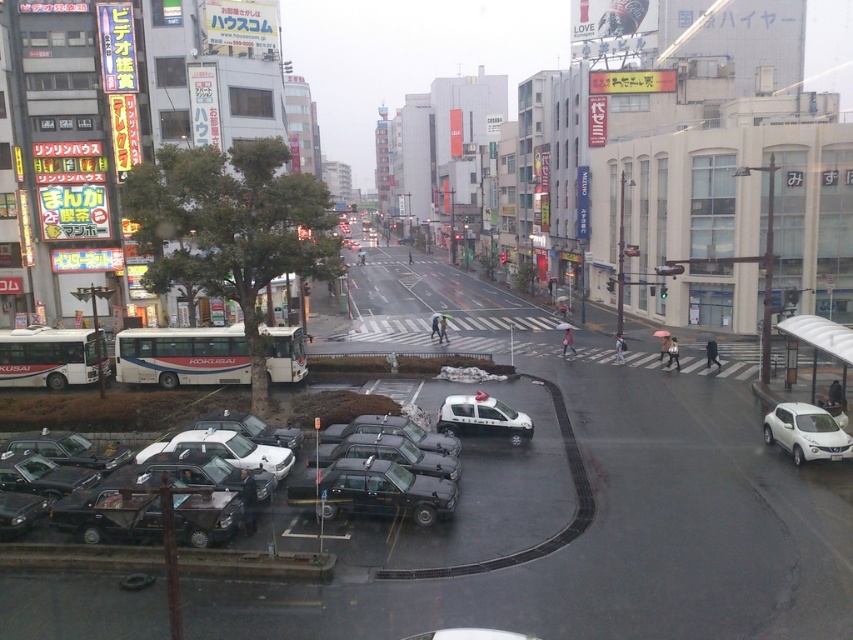
Question: Is the position of white matte suv at lower right less distant than that of white glossy car at center?

Choices:
 (A) yes
 (B) no

Answer: (A)

Question: Which of these objects is positioned closest to the black rubber taxi at lower left?

Choices:
 (A) white matte suv at lower right
 (B) white glossy car at center

Answer: (B)

Question: Which of the following is the closest to the observer?

Choices:
 (A) (815, 444)
 (B) (402, 513)
 (C) (486, 397)

Answer: (B)

Question: In this image, where is white matte suv at lower right located relative to white glossy car at center?

Choices:
 (A) below
 (B) above

Answer: (B)

Question: Is white matte suv at lower right in front of white glossy car at center?

Choices:
 (A) yes
 (B) no

Answer: (A)

Question: Which object is positioned closest to the black rubber taxi at lower left?

Choices:
 (A) white matte suv at lower right
 (B) white glossy car at center

Answer: (B)